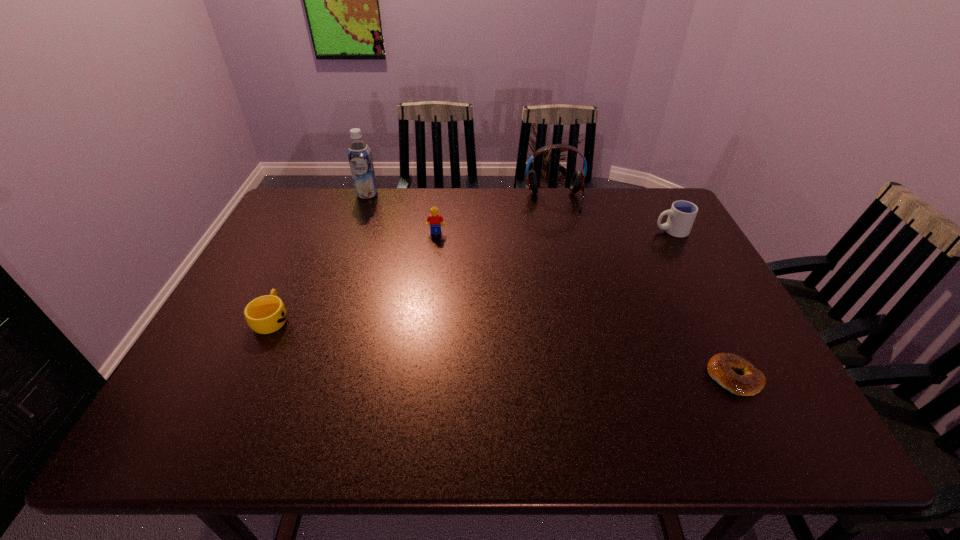
Locate an element on the screen. The height and width of the screenshot is (540, 960). free area in between the headset and the left cup is located at coordinates (414, 259).

Identify which object is the fourth nearest to the shortest object. Please provide its 2D coordinates. Your answer should be formatted as a tuple, i.e. [(x, y)], where the tuple contains the x and y coordinates of a point satisfying the conditions above.

[(266, 314)]

Select which object appears as the fourth closest to the fifth object from right to left. Please provide its 2D coordinates. Your answer should be formatted as a tuple, i.e. [(x, y)], where the tuple contains the x and y coordinates of a point satisfying the conditions above.

[(682, 214)]

Locate an element on the screen. The width and height of the screenshot is (960, 540). free point that satisfies the following two spatial constraints: 1. with the handle on the side of the right cup; 2. on the front side of the fifth tallest object is located at coordinates (719, 319).